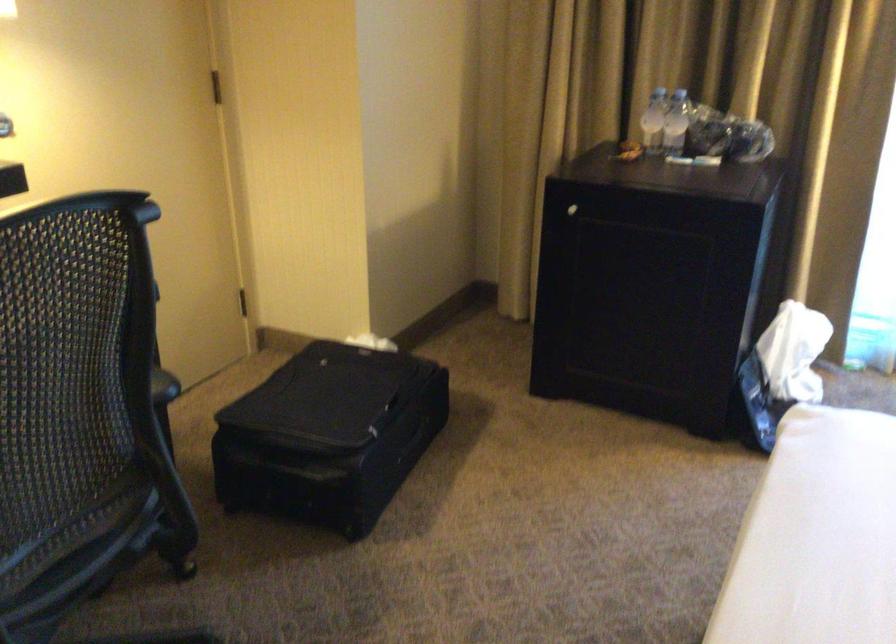
Find where to grasp the black chair armrest. Please return your answer as a coordinate pair (x, y).

(162, 386)